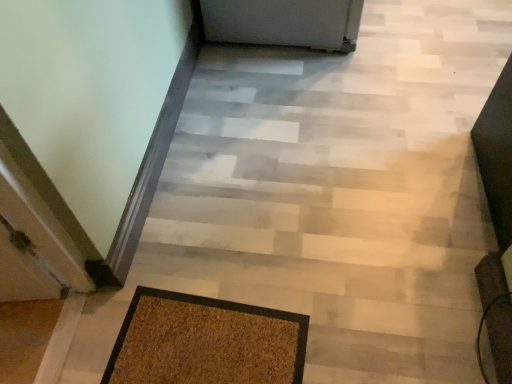
I want to click on vacant space underneath brown textured mat at lower center (from a real-world perspective), so click(211, 345).